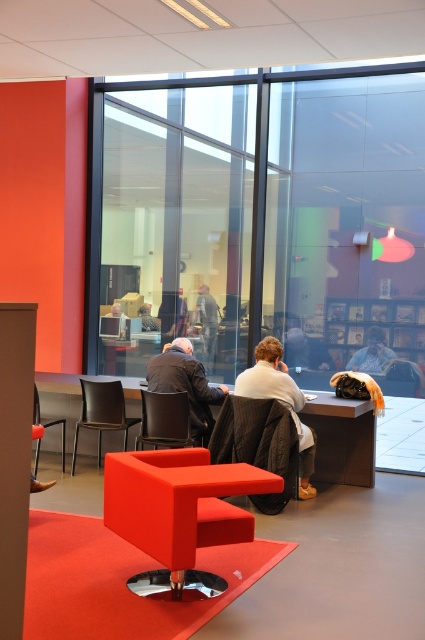
You are standing at the entrance of the office and want to sit in the black leather chair at center. What are the coordinates of the chair?

The coordinates of the black leather chair at center are point (164,419).